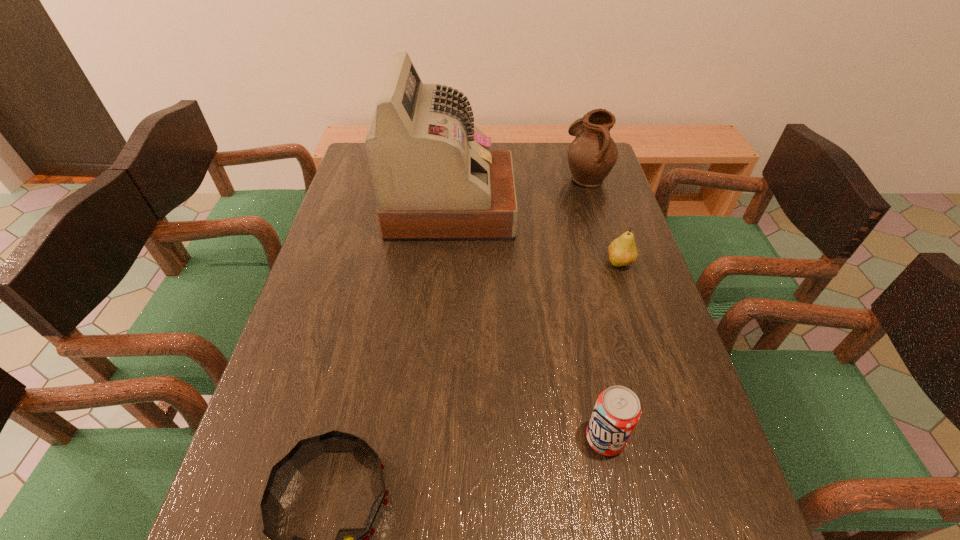
In the image, there is a desktop. In order to click on vacant region at the right edge in this screenshot , I will do `click(620, 346)`.

Image resolution: width=960 pixels, height=540 pixels. In order to click on vacant point located between the fourth shortest object and the third farthest object in this screenshot , I will do `click(603, 220)`.

Identify the location of blank region between the cash register and the third object from right to left. (528, 323).

Locate an element on the screen. The height and width of the screenshot is (540, 960). free space that is in between the pitcher and the third object from left to right is located at coordinates (595, 308).

In order to click on free space between the second tallest object and the third farthest object in this screenshot , I will do `click(603, 220)`.

Where is `vacant area that lies between the third nearest object and the soda can`? Image resolution: width=960 pixels, height=540 pixels. vacant area that lies between the third nearest object and the soda can is located at coordinates (612, 352).

The width and height of the screenshot is (960, 540). I want to click on free space between the third farthest object and the tallest object, so click(536, 235).

You are a GUI agent. You are given a task and a screenshot of the screen. Output one action in this format:
    pyautogui.click(x=<x>, y=<y>)
    Task: Click on the free space between the cash register and the pear
    
    Given the screenshot: What is the action you would take?
    pyautogui.click(x=536, y=235)

The image size is (960, 540). What are the coordinates of `vacant space in between the tallest object and the soda can` in the screenshot? It's located at (528, 323).

What are the coordinates of `object that is the second closest to the tallest object` in the screenshot? It's located at (622, 252).